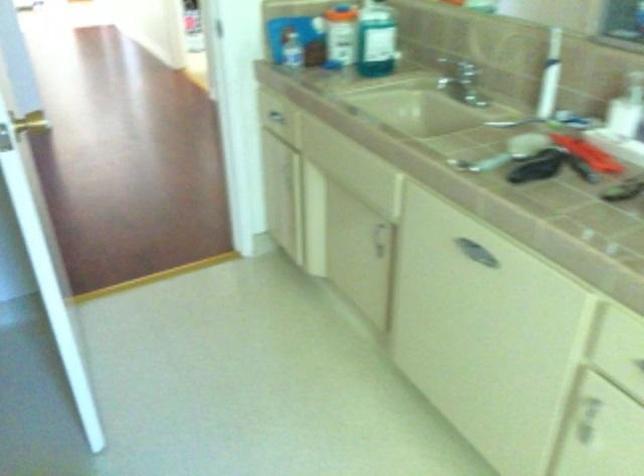
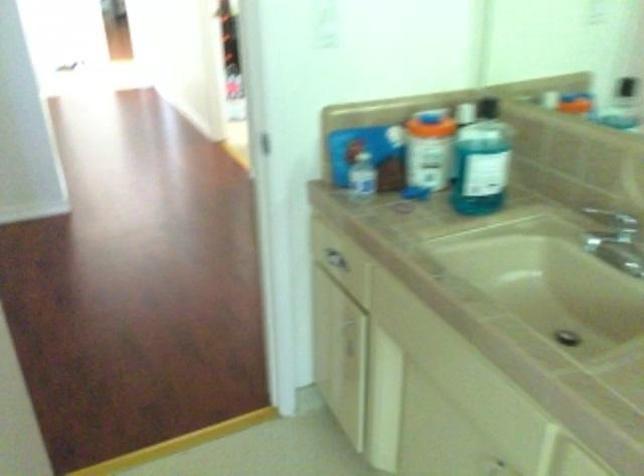
Question: How did the camera likely rotate?

Choices:
 (A) Left
 (B) Right
 (C) Up
 (D) Down

Answer: (C)